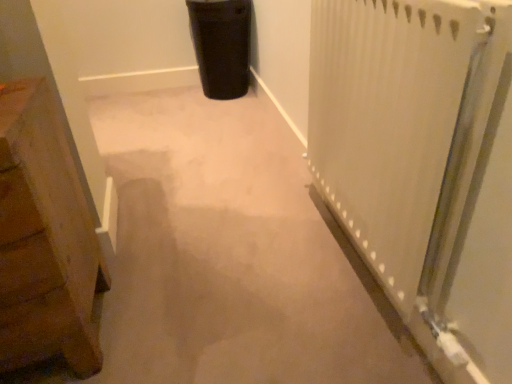
Question: Considering the positions of white textured radiator at right and black matte trash can at upper center in the image, is white textured radiator at right wider or thinner than black matte trash can at upper center?

Choices:
 (A) thin
 (B) wide

Answer: (A)

Question: Considering the positions of point (416, 226) and point (199, 39), is point (416, 226) closer or farther from the camera than point (199, 39)?

Choices:
 (A) farther
 (B) closer

Answer: (B)

Question: Which is nearer to the black matte trash can at upper center?

Choices:
 (A) white textured radiator at right
 (B) wooden chest at left

Answer: (A)

Question: Based on their relative distances, which object is farther from the wooden chest at left?

Choices:
 (A) black matte trash can at upper center
 (B) white textured radiator at right

Answer: (A)